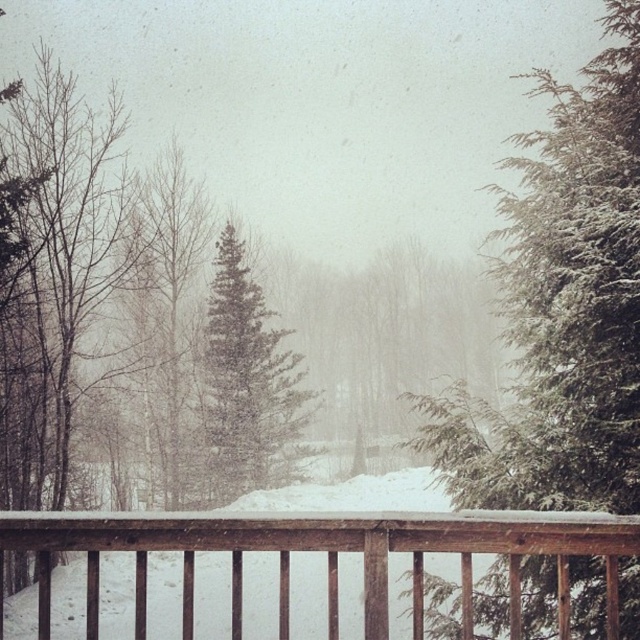
Question: Which object appears farthest from the camera in this image?

Choices:
 (A) green matte evergreen tree at center
 (B) green textured evergreen tree at right

Answer: (A)

Question: Can you confirm if green textured evergreen tree at right is thinner than brown wooden railing at center?

Choices:
 (A) yes
 (B) no

Answer: (B)

Question: Which point is farther from the camera taking this photo?

Choices:
 (A) (522, 228)
 (B) (156, 520)

Answer: (A)

Question: Does green textured evergreen tree at right appear on the left side of green matte evergreen tree at center?

Choices:
 (A) yes
 (B) no

Answer: (B)

Question: Is brown wooden railing at center smaller than green matte evergreen tree at center?

Choices:
 (A) no
 (B) yes

Answer: (B)

Question: Which point is closer to the camera?

Choices:
 (A) (237, 467)
 (B) (516, 134)
 (C) (332, 628)

Answer: (C)